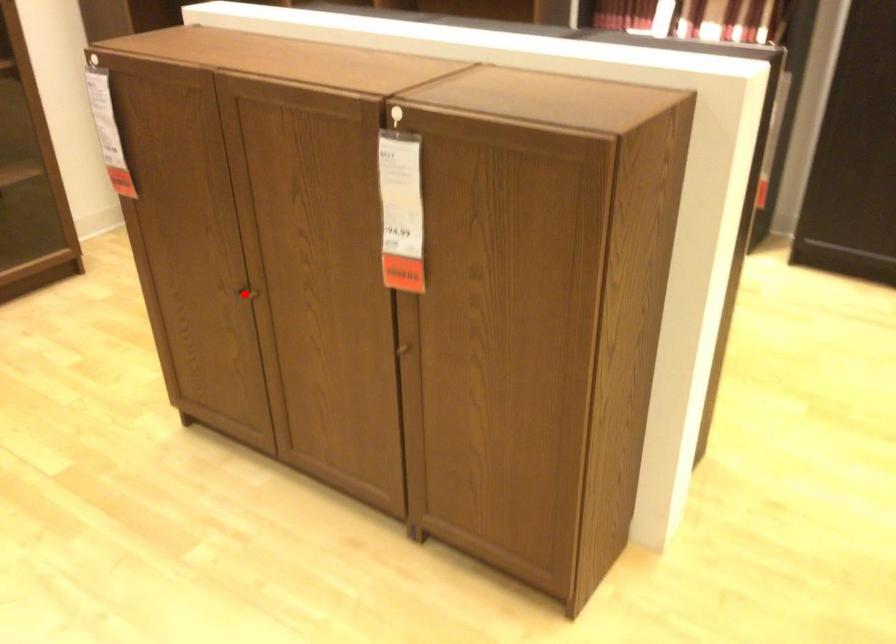
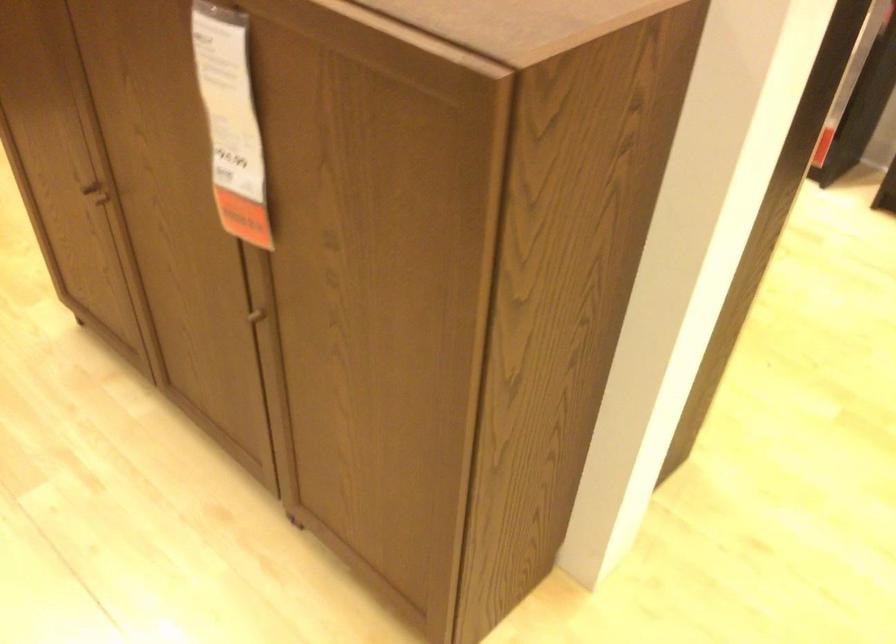
Question: A red point is marked in image1. In image2, is the corresponding 3D point closer to the camera or farther? Reply with the corresponding letter.

Choices:
 (A) The corresponding 3D point is closer.
 (B) The corresponding 3D point is farther.

Answer: (A)